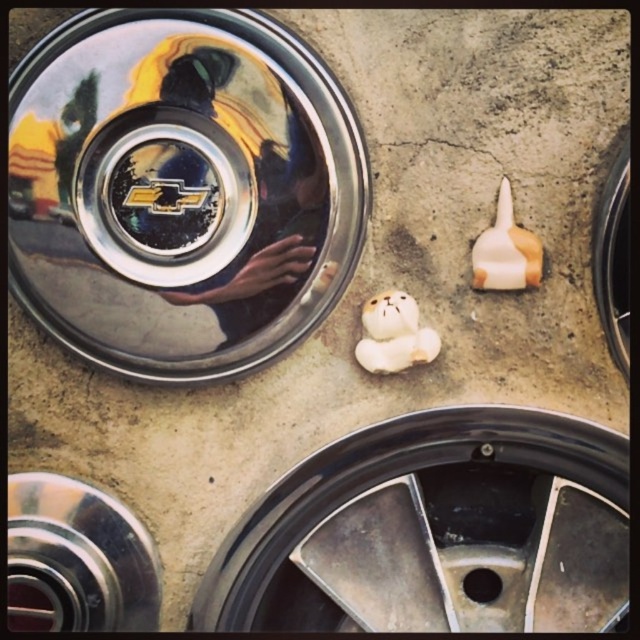
You are standing in front of a car repair shop. You see a chrome metallic hubcap at upper left and a metallic silver wheel at bottom center. Which object is positioned more to the left side of the scene?

The chrome metallic hubcap at upper left is positioned more to the left side of the scene compared to the metallic silver wheel at bottom center.

What are the coordinates of the chrome metallic hubcap at upper left?

The coordinates of the chrome metallic hubcap at upper left are at point (x=180, y=189).